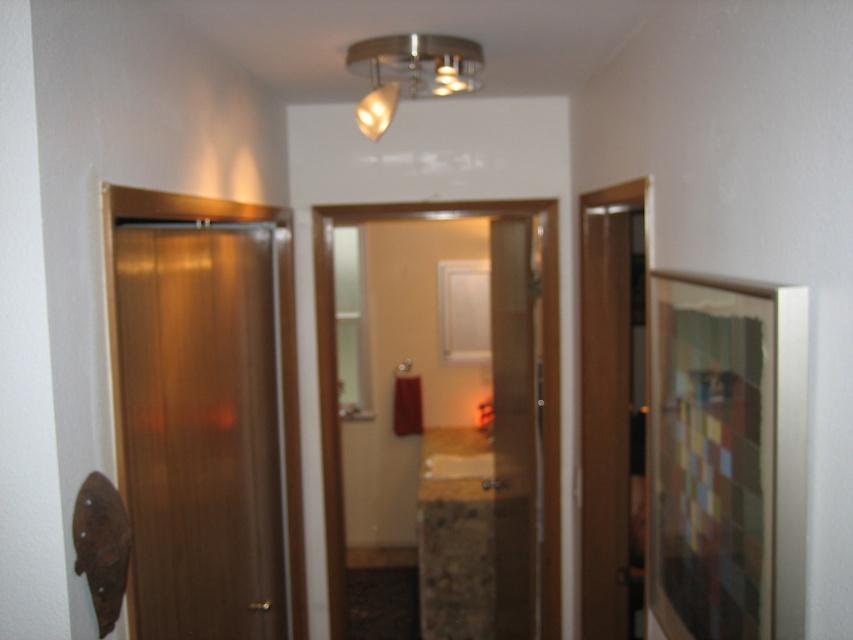
You are a delivery person carrying a package that is 2 meters tall. You need to pass through either the matte brown door at left or the translucent glass elevator at center. Based on their heights, which one can you use to enter the building?

The translucent glass elevator at center is taller than the matte brown door at left. Since your package is 2 meters tall, you should use the translucent glass elevator at center to enter the building as it is tall enough to accommodate the package.